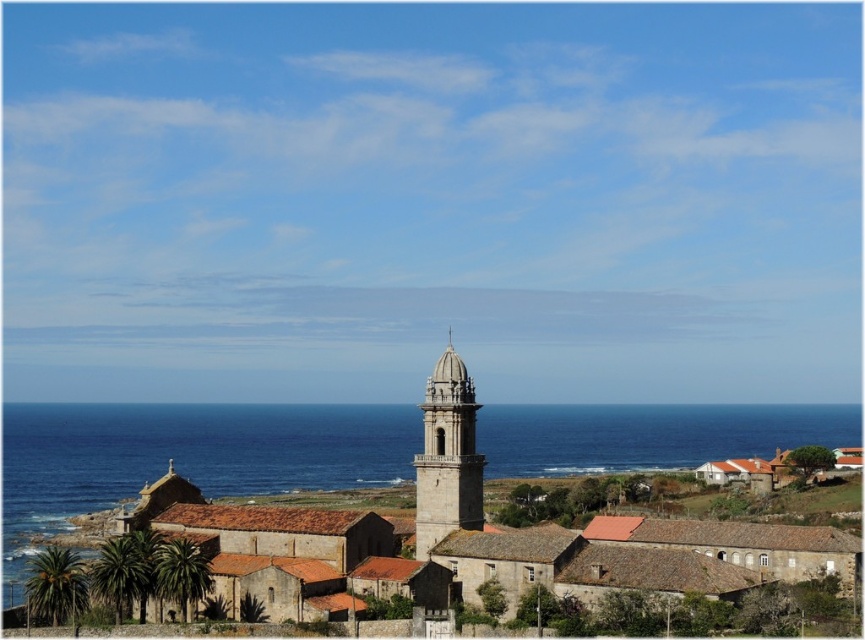
Which of these two, blue water at center or stone steeple at center, stands shorter?

stone steeple at center

Locate an element on the screen. The height and width of the screenshot is (640, 865). blue water at center is located at coordinates (188, 454).

What do you see at coordinates (188, 454) in the screenshot? I see `blue water at center` at bounding box center [188, 454].

Locate an element on the screen. Image resolution: width=865 pixels, height=640 pixels. blue water at center is located at coordinates (188, 454).